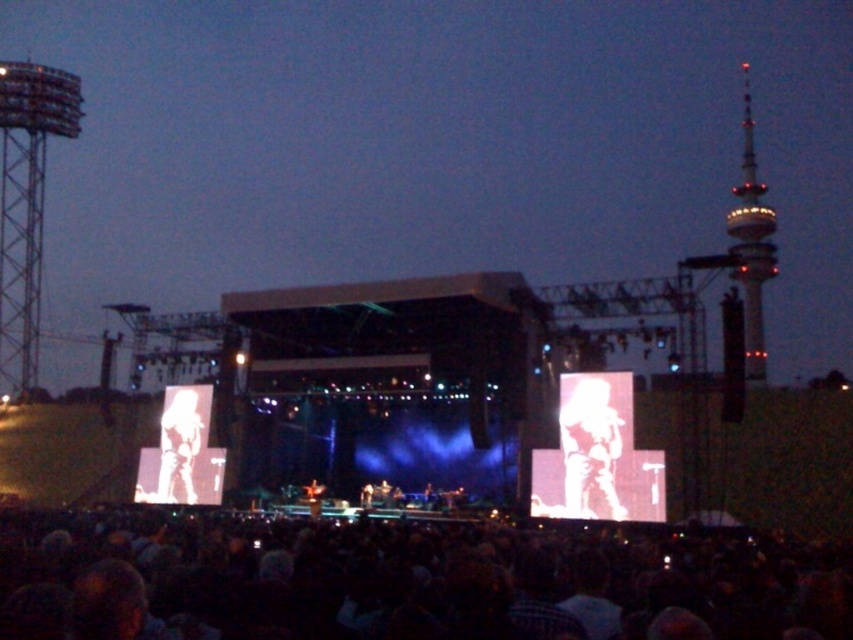
Question: Which point is closer to the camera?

Choices:
 (A) metallic tower at right
 (B) silhouette paper cutout at center
 (C) silhouette figure at center

Answer: (C)

Question: Is metallic tower at right behind silhouette paper cutout at center?

Choices:
 (A) no
 (B) yes

Answer: (A)

Question: Can you confirm if dark matte crowd at lower center is wider than silhouette figure at center?

Choices:
 (A) no
 (B) yes

Answer: (B)

Question: Considering the real-world distances, which object is closest to the metallic tower at right?

Choices:
 (A) dark matte crowd at lower center
 (B) silhouette figure at center
 (C) silhouette paper cutout at center

Answer: (B)

Question: Among these points, which one is farthest from the camera?

Choices:
 (A) (743, 150)
 (B) (167, 477)
 (C) (751, 614)

Answer: (A)

Question: Can you confirm if dark matte crowd at lower center is positioned to the right of metallic tower at right?

Choices:
 (A) no
 (B) yes

Answer: (A)